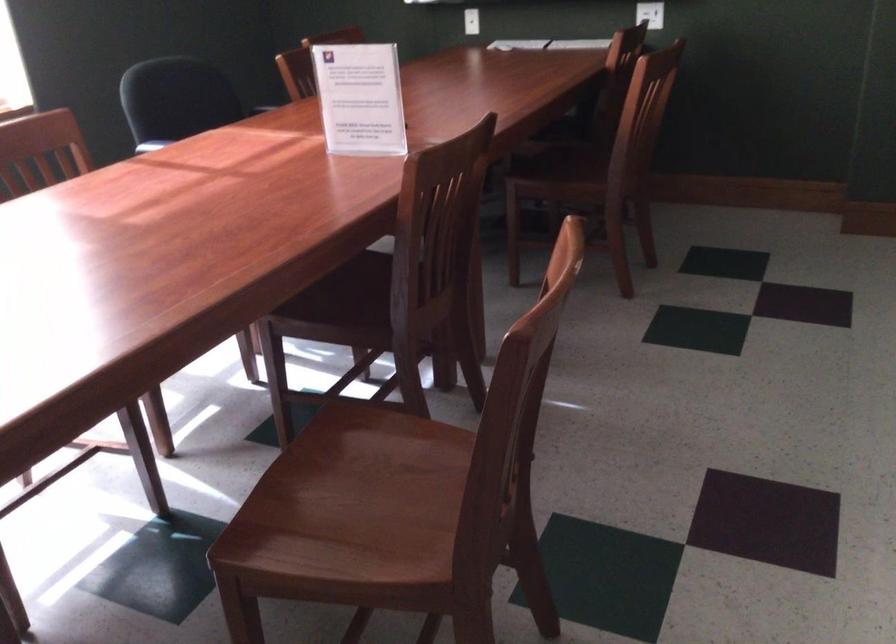
Which object does [359,98] point to?

This point indicates the clear sign holder.